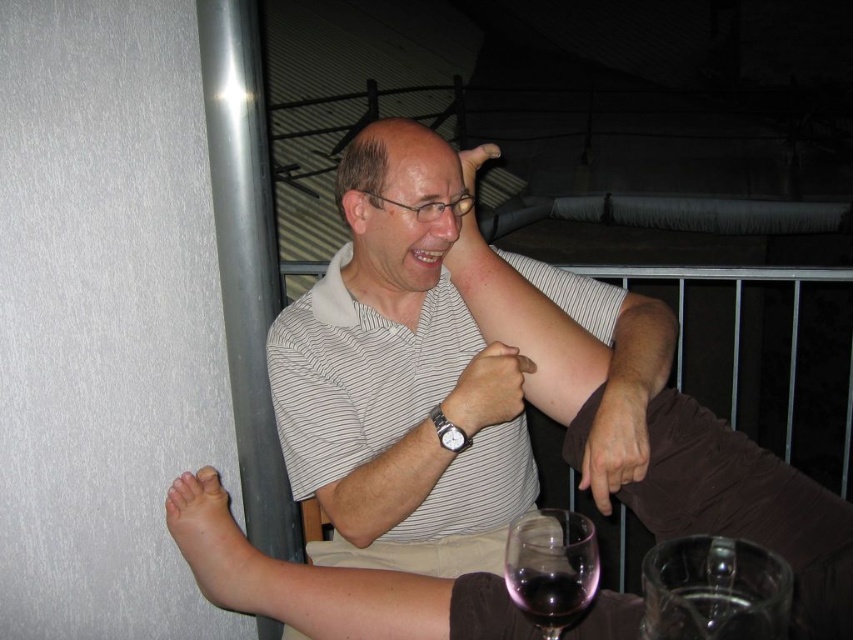
You are a photographer trying to capture the man in the scene. Since the matte striped shirt at center and the silver metallic watch at center are both visible, which object is closer to the camera?

The matte striped shirt at center is in front of the silver metallic watch at center, so the matte striped shirt at center is closer to the camera.

In the scene shown: You are a photographer trying to capture a candid shot of the man without him noticing. You have a camera with a zoom lens that can focus on objects up to 1 meter away. The striped cotton shirt at center and transparent glass at lower center are both in your field of view. Which object should you focus on to ensure the man is in focus?

You should focus on the striped cotton shirt at center because it is closer to you than the transparent glass at lower center, ensuring the man will be in focus.

You are a tailor measuring for a new outfit. You notice the matte striped shirt at center and the silver metallic watch at center. Which item has a greater width?

The matte striped shirt at center is wider than the silver metallic watch at center according to the description.